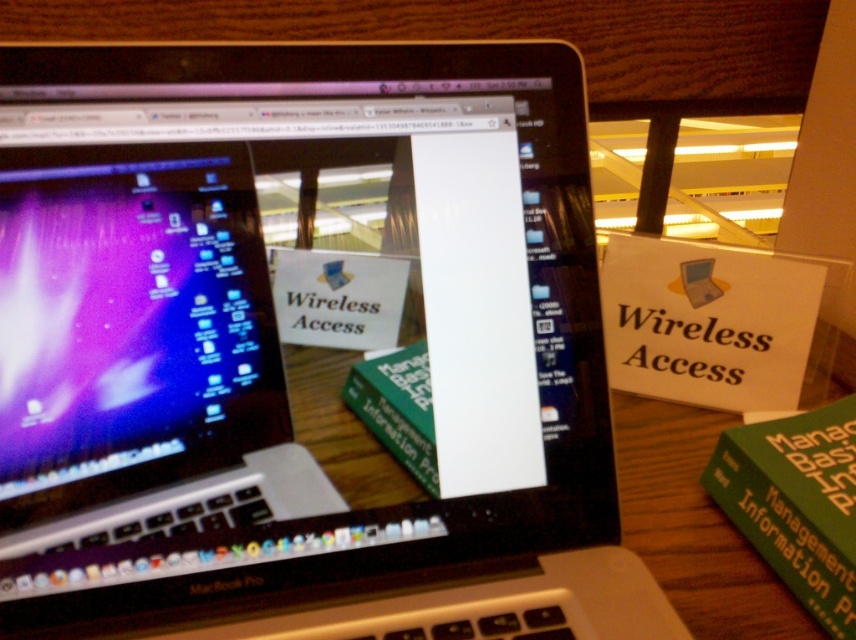
You are trying to place a 12 inch ruler between the matte black laptop at left and the green matte book at lower right. Will it fit without overlapping either object?

The distance between the matte black laptop at left and the green matte book at lower right is 14.72 inches. Since the ruler is 12 inches long, it will fit between them without overlapping either object.

Based on the photo, you are trying to determine the relative positions of two points on the screen of the MacBook Pro laptop shown in the image. The first point is at coordinates point (165, 227) and the second point is at point (779, 577). From your perspective looking at the laptop screen, which point is closer to you?

Point (165, 227) is in front of point (779, 577), so from your perspective looking at the laptop screen, point (165, 227) is closer to you.